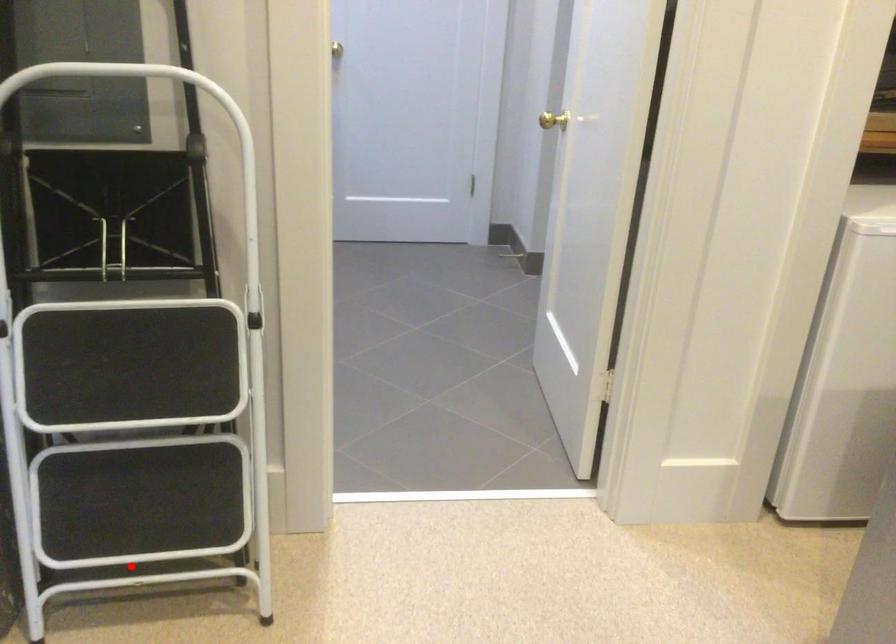
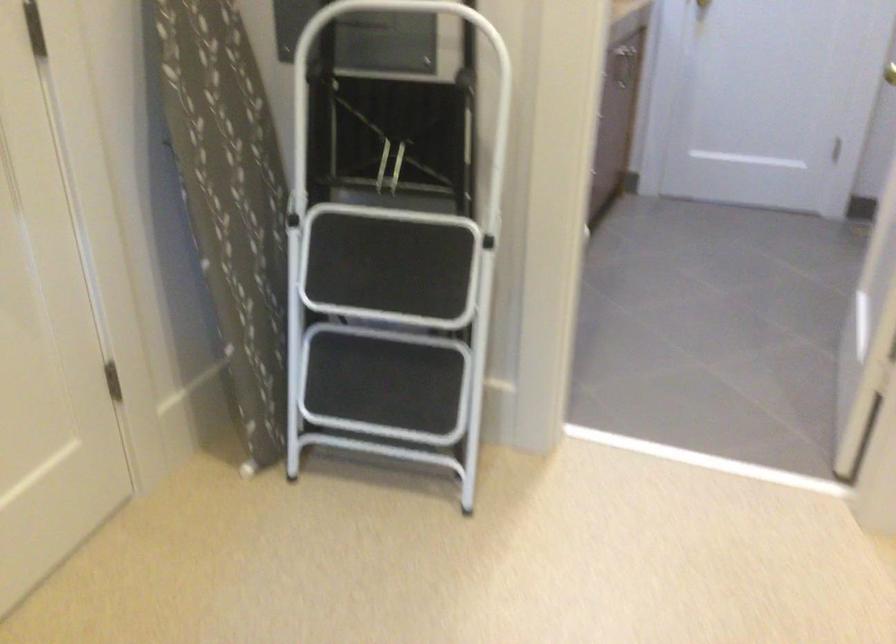
Question: I am providing you with two images of the same scene from different viewpoints. In image1, a red point is highlighted. Considering the same 3D point in image2, which of the following is correct?

Choices:
 (A) It is closer
 (B) It is farther

Answer: (B)